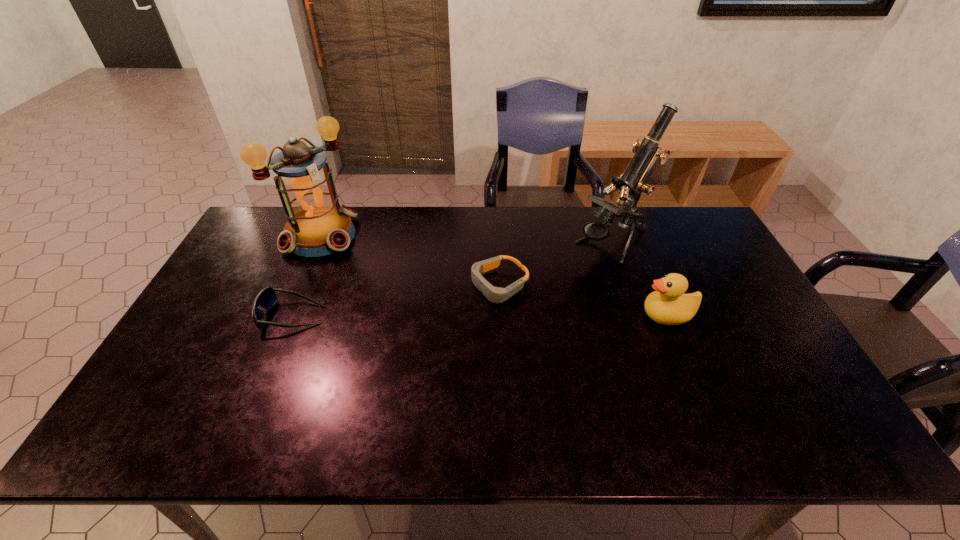
Image resolution: width=960 pixels, height=540 pixels. I want to click on free spot at the near left corner of the desktop, so click(x=200, y=403).

You are a GUI agent. You are given a task and a screenshot of the screen. Output one action in this format:
    pyautogui.click(x=<x>, y=<y>)
    Task: Click on the vacant area at the far right corner
    The width and height of the screenshot is (960, 540).
    Given the screenshot: What is the action you would take?
    pyautogui.click(x=676, y=218)

Identify the location of free space that is in between the third object from left to right and the second shortest object. (396, 300).

Identify the location of empty location between the microscope and the lantern. The width and height of the screenshot is (960, 540). (467, 239).

I want to click on free space between the third object from left to right and the lantern, so click(x=410, y=260).

The width and height of the screenshot is (960, 540). Find the location of `vacant area that lies between the sunglasses and the shortest object`. vacant area that lies between the sunglasses and the shortest object is located at coordinates (396, 300).

This screenshot has height=540, width=960. Identify the location of free spot between the goggles and the fourth shortest object. (410, 260).

Identify the location of free space between the third shortest object and the fourth tallest object. (480, 315).

Image resolution: width=960 pixels, height=540 pixels. What are the coordinates of `vacant space that's between the microscope and the duck` in the screenshot? It's located at (640, 279).

Locate an element on the screen. free space that is in between the third tallest object and the third object from right to left is located at coordinates (584, 300).